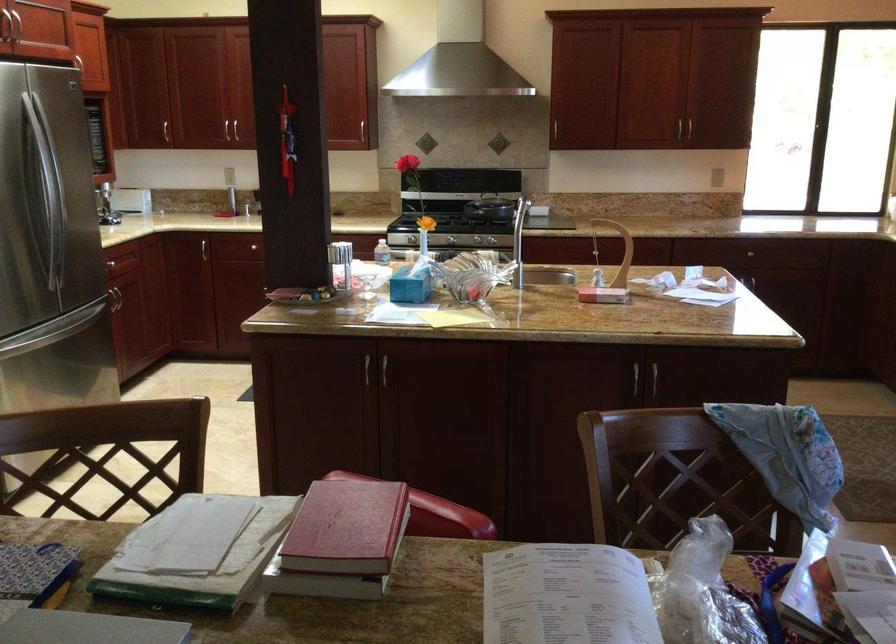
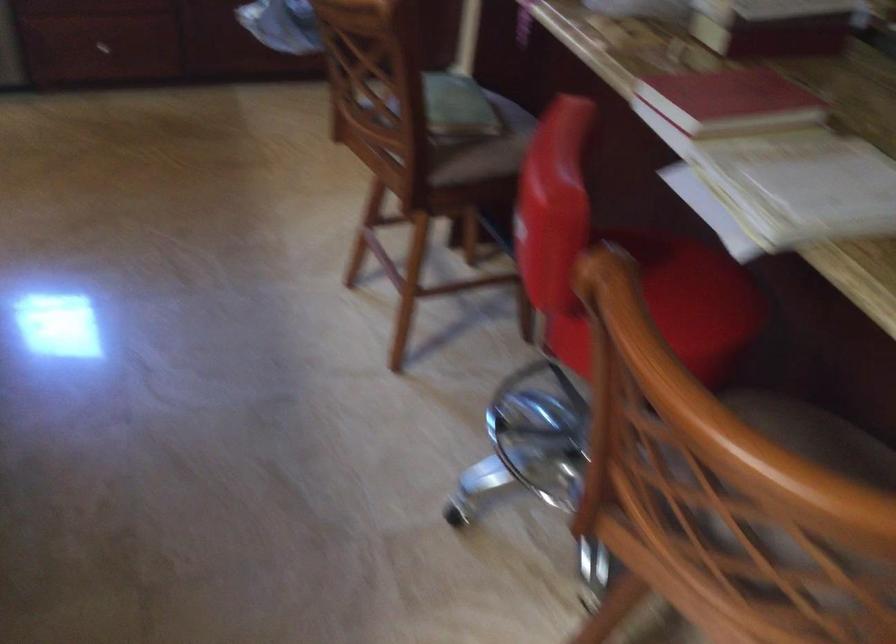
Where in the second image is the point corresponding to [304,504] from the first image?

(729, 100)